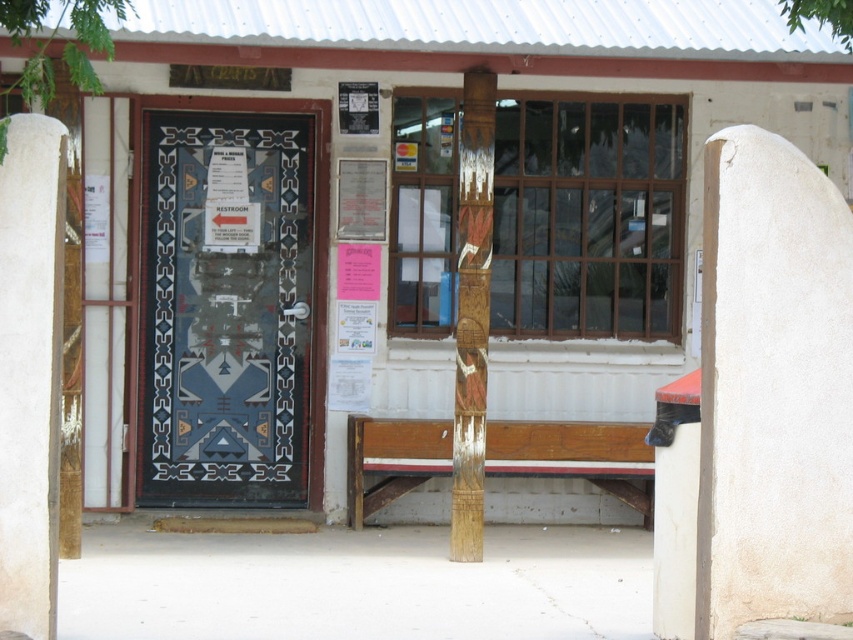
You are a delivery person trying to enter the building. The entrance is through the decorative glass door at center. There is a white stucco pillar at center nearby. Which object is wider when viewed from the front?

The decorative glass door at center is wider than the white stucco pillar at center.

You are standing at the entrance of the building and want to sit down. The white stucco pillar at center and the wooden bench at center are both in your view. Which object is closer to you?

The white stucco pillar at center is closer to you since it is in front of the wooden bench at center.